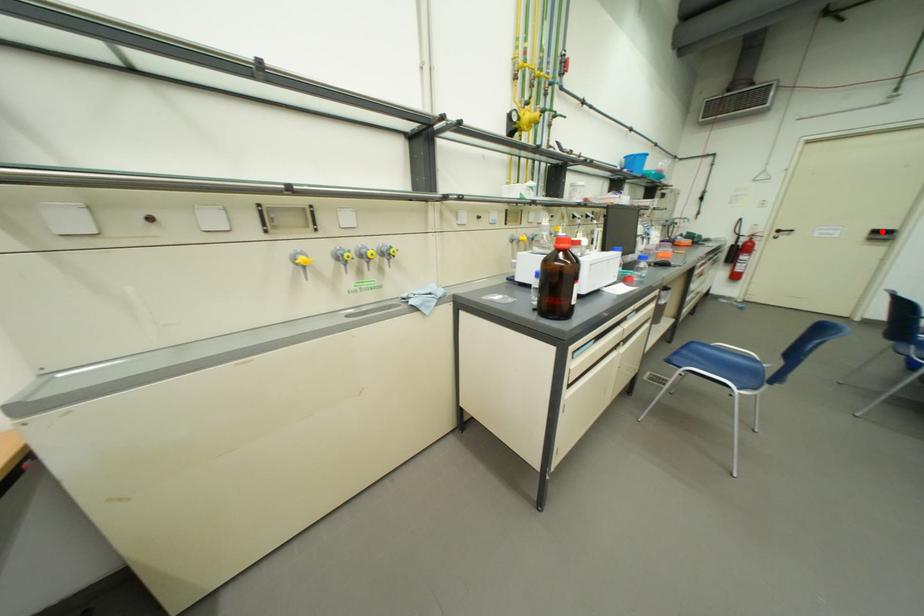
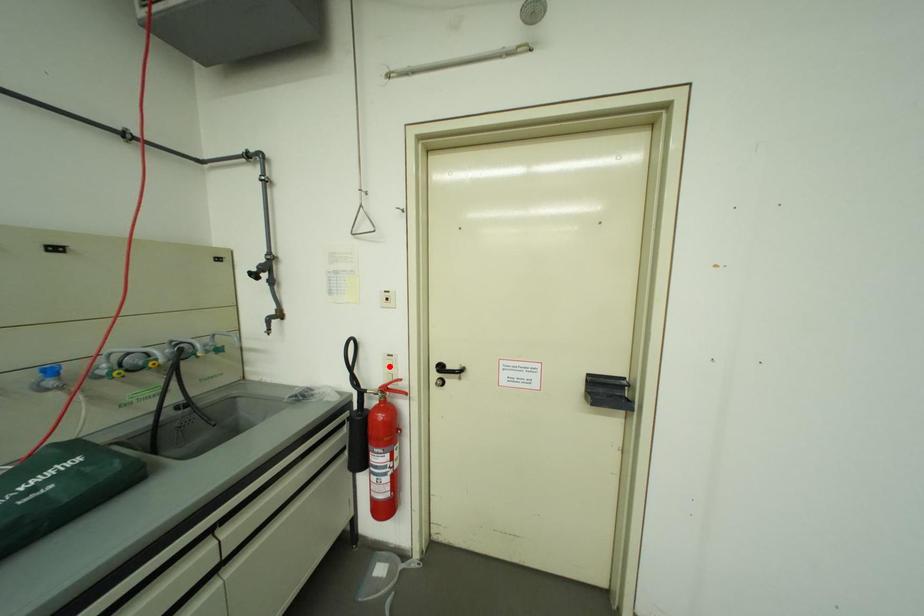
I am providing you with two images of the same scene from different viewpoints. A red point is marked on the first image and another point is marked on the second image. Is the marked point in image1 the same physical position as the marked point in image2?

No